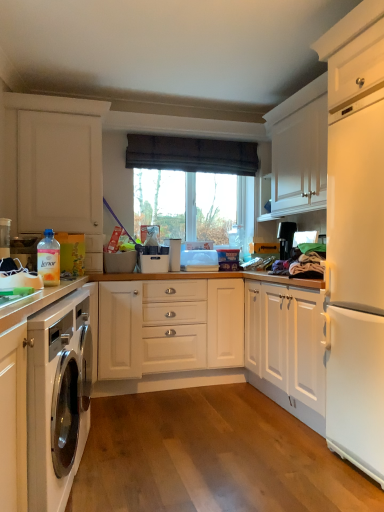
Question: Can you confirm if dark brown fabric at upper center is taller than white matte cabinet at left, marked as the 1th cabinetry in a back-to-front arrangement?

Choices:
 (A) no
 (B) yes

Answer: (A)

Question: Is dark brown fabric at upper center smaller than white matte cabinet at left, the second cabinetry when ordered from bottom to top?

Choices:
 (A) no
 (B) yes

Answer: (B)

Question: Are dark brown fabric at upper center and white matte cabinet at left, positioned as the 2th cabinetry in front-to-back order, located far from each other?

Choices:
 (A) yes
 (B) no

Answer: (B)

Question: Considering the relative sizes of dark brown fabric at upper center and white matte cabinet at left, positioned as the 2th cabinetry in front-to-back order, in the image provided, is dark brown fabric at upper center bigger than white matte cabinet at left, positioned as the 2th cabinetry in front-to-back order,?

Choices:
 (A) yes
 (B) no

Answer: (B)

Question: From a real-world perspective, is dark brown fabric at upper center under white matte cabinet at left, the second cabinetry when ordered from bottom to top?

Choices:
 (A) yes
 (B) no

Answer: (B)

Question: Relative to black plastic coffee maker at upper right, is dark brown fabric at upper center in front or behind?

Choices:
 (A) front
 (B) behind

Answer: (A)

Question: Is dark brown fabric at upper center spatially inside black plastic coffee maker at upper right, or outside of it?

Choices:
 (A) outside
 (B) inside

Answer: (A)

Question: In terms of height, does dark brown fabric at upper center look taller or shorter compared to black plastic coffee maker at upper right?

Choices:
 (A) short
 (B) tall

Answer: (A)

Question: Is point (160, 142) closer or farther from the camera than point (281, 259)?

Choices:
 (A) closer
 (B) farther

Answer: (B)

Question: Does point (279, 251) appear closer or farther from the camera than point (142, 147)?

Choices:
 (A) closer
 (B) farther

Answer: (A)

Question: From the image's perspective, is black plastic coffee maker at upper right positioned above or below dark brown fabric at upper center?

Choices:
 (A) above
 (B) below

Answer: (B)

Question: Considering the positions of black plastic coffee maker at upper right and dark brown fabric at upper center in the image, is black plastic coffee maker at upper right wider or thinner than dark brown fabric at upper center?

Choices:
 (A) wide
 (B) thin

Answer: (A)

Question: In the image, is black plastic coffee maker at upper right positioned in front of or behind dark brown fabric at upper center?

Choices:
 (A) behind
 (B) front

Answer: (A)

Question: Is black plastic coffee maker at upper right inside the boundaries of white matte cabinet at left, the 1th cabinetry from the top, or outside?

Choices:
 (A) inside
 (B) outside

Answer: (B)

Question: Is black plastic coffee maker at upper right in front of or behind white matte cabinet at left, positioned as the 2th cabinetry in front-to-back order, in the image?

Choices:
 (A) front
 (B) behind

Answer: (B)